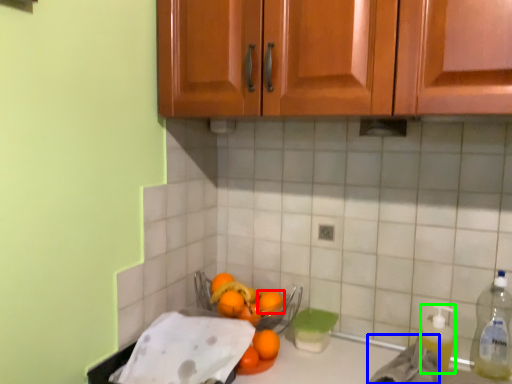
Question: Which object is the farthest from orange (highlighted by a red box)? Choose among these: material (highlighted by a blue box) or cleaning product (highlighted by a green box).

Choices:
 (A) material
 (B) cleaning product

Answer: (B)